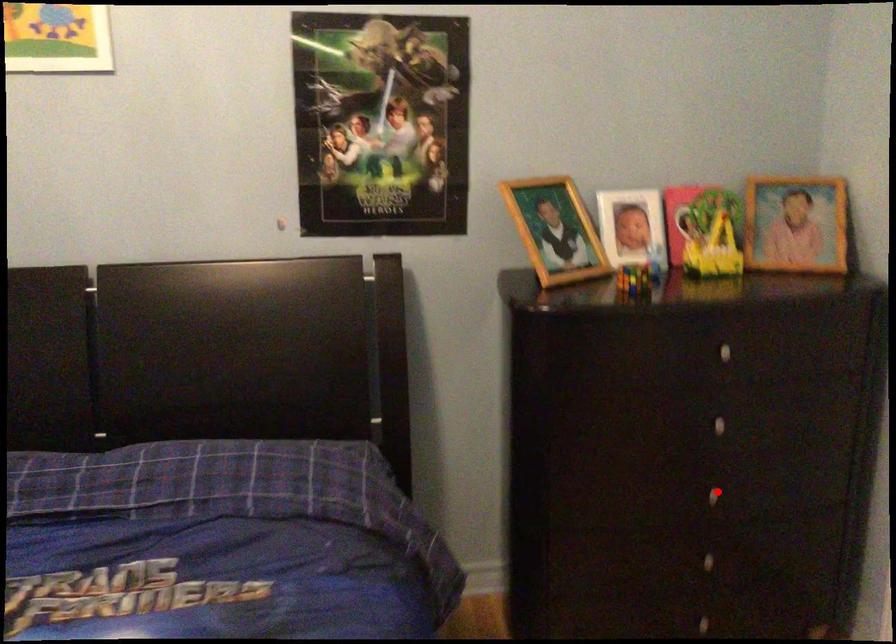
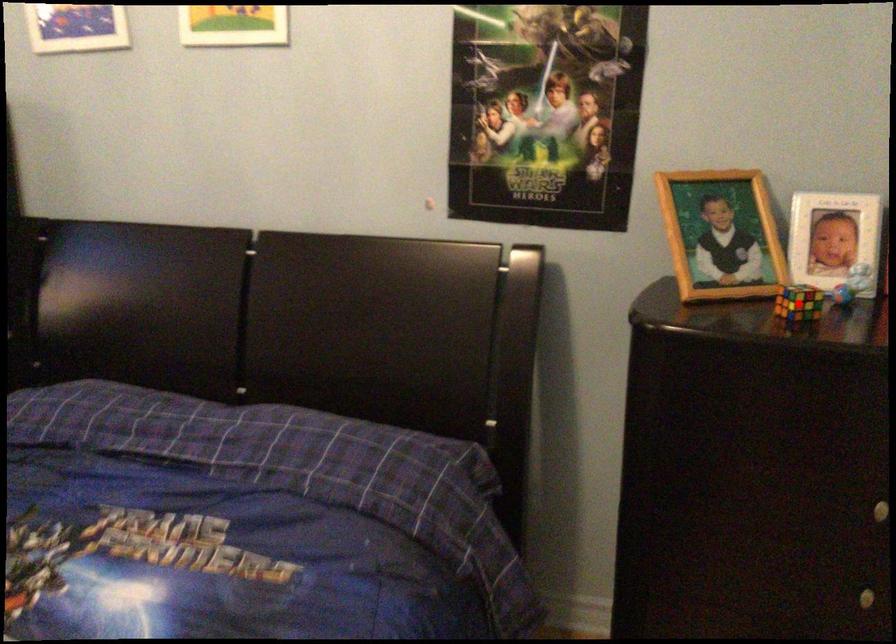
I am providing you with two images of the same scene from different viewpoints. A red point is marked on the first image and another point is marked on the second image. Are the points marked in image1 and image2 representing the same 3D position?

No